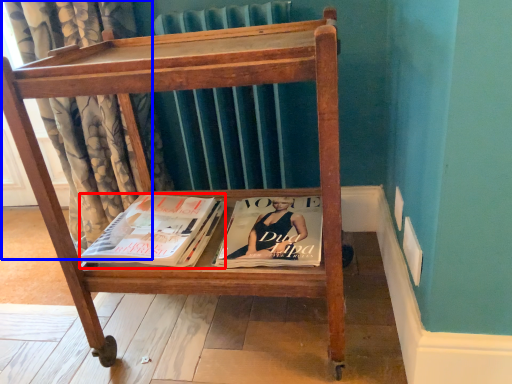
Question: Among these objects, which one is farthest to the camera, book (highlighted by a red box) or curtain (highlighted by a blue box)?

Choices:
 (A) book
 (B) curtain

Answer: (B)